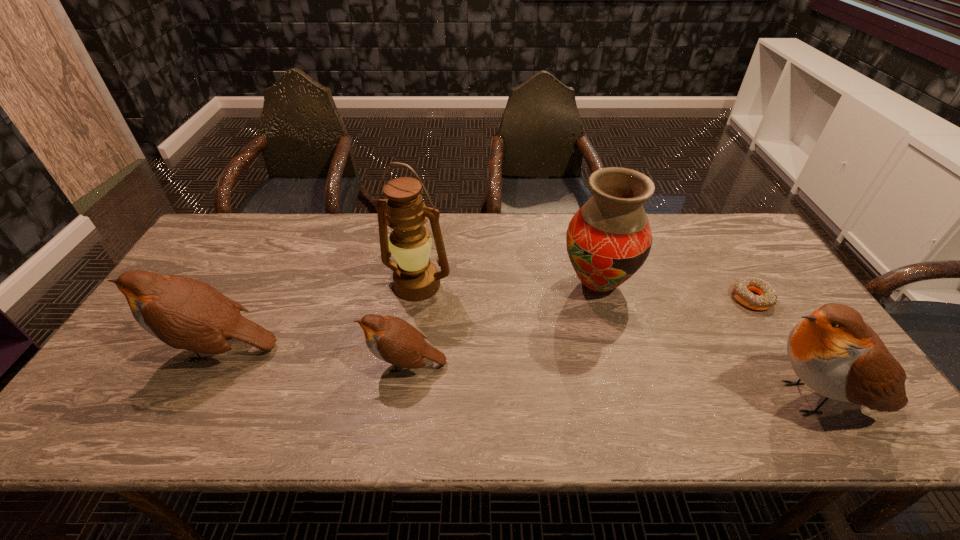
Locate an element on the screen. Image resolution: width=960 pixels, height=540 pixels. bird that is the second closest to the vase is located at coordinates (393, 340).

The height and width of the screenshot is (540, 960). In order to click on the second closest bird to the leftmost object in this screenshot , I will do `click(833, 351)`.

The width and height of the screenshot is (960, 540). Identify the location of vacant space that satisfies the following two spatial constraints: 1. on the front side of the doughnut; 2. on the right side of the oil lamp. (416, 298).